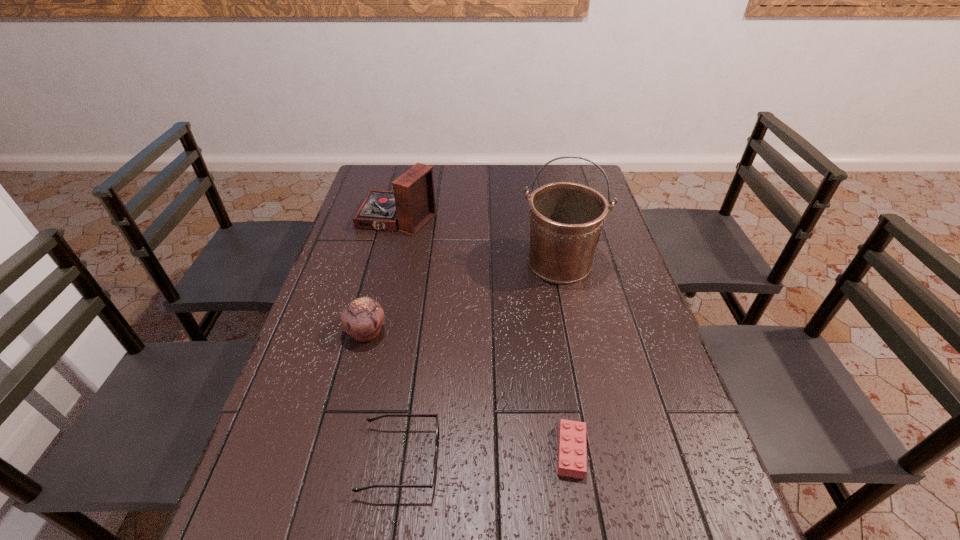
Where is `bucket`? The height and width of the screenshot is (540, 960). bucket is located at coordinates 566,219.

Identify the location of the second tallest object. Image resolution: width=960 pixels, height=540 pixels. (411, 205).

Find the location of a particular element. This screenshot has width=960, height=540. the third farthest object is located at coordinates (363, 318).

You are a GUI agent. You are given a task and a screenshot of the screen. Output one action in this format:
    pyautogui.click(x=<x>, y=<y>)
    Task: Click on the third shortest object
    Image resolution: width=960 pixels, height=540 pixels.
    Given the screenshot: What is the action you would take?
    pyautogui.click(x=363, y=318)

Where is `sunglasses`? The image size is (960, 540). sunglasses is located at coordinates (434, 474).

The image size is (960, 540). Identify the location of Lego. (572, 462).

The height and width of the screenshot is (540, 960). Identify the location of vacant space located 0.290m on the left of the bucket. (423, 263).

At what (x,y) coordinates should I click in order to perform the action: click on vacant region located 0.200m on the right of the phonograph record. Please return your answer as a coordinate pair (x, y). The image size is (960, 540). Looking at the image, I should click on (495, 220).

Where is `vacant space located 0.190m on the front of the third shortest object`? vacant space located 0.190m on the front of the third shortest object is located at coordinates (345, 419).

I want to click on free spot located 0.180m on the front lenses of the sunglasses, so click(x=528, y=460).